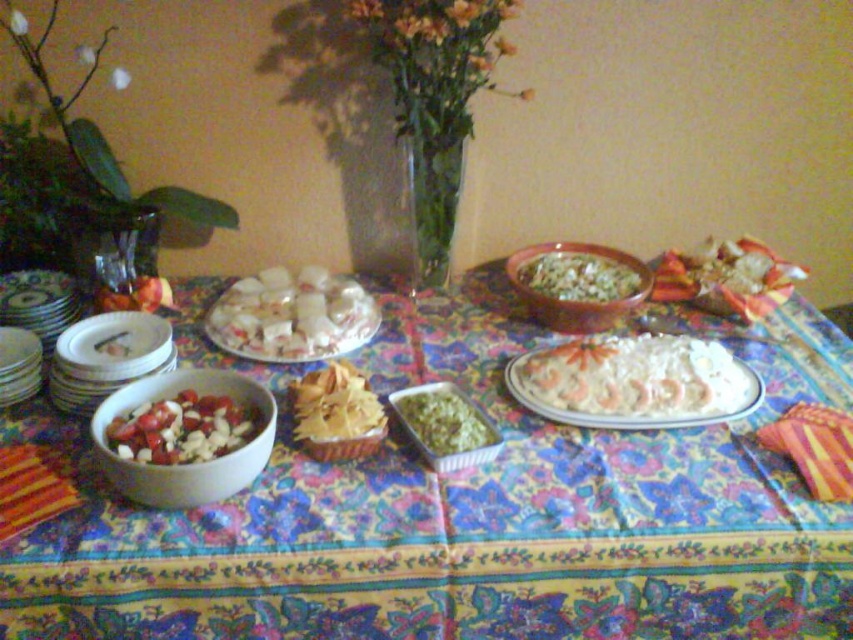
You are a guest at the table and want to reach for the golden crispy chips at center. However, there is a white creamy cake at center in your way. Based on the arrangement, can you easily access the chips without moving the cake?

The golden crispy chips at center is behind the white creamy cake at center, so you cannot easily access the chips without moving the cake.

You are a guest at the table and want to reach for the matte brown bowl at center and the green leafy salad at center. Considering the space between them, can you easily grab both items without moving your hand too much?

The distance between the matte brown bowl at center and the green leafy salad at center is only 1.03 centimeters, so you can easily grab both items without moving your hand too much.

You are a guest at a dinner party and want to compare the sizes of the white creamy cubes at center and the white glossy beans at lower left. Which one has a greater width?

The white creamy cubes at center has a greater width than the white glossy beans at lower left according to the description.